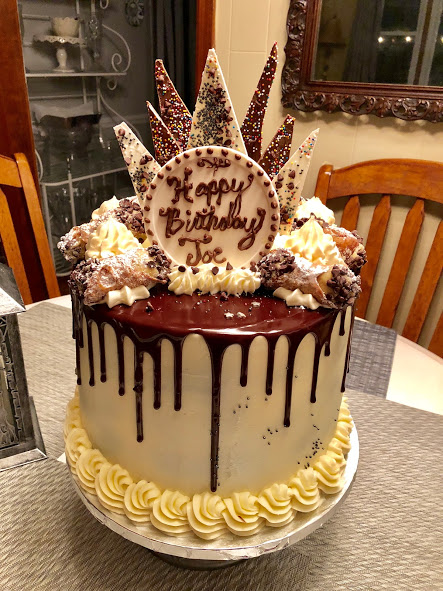
Locate an element on the screen. The image size is (443, 591). white metal bakers rack in left side background is located at coordinates (115, 74).